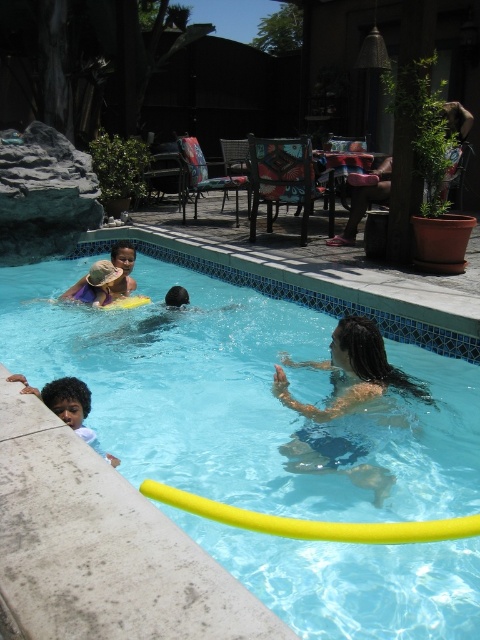
Question: Is brown leather chair at upper right thinner than light brown skin at lower left?

Choices:
 (A) no
 (B) yes

Answer: (A)

Question: Considering the relative positions of transparent blue water at center and light brown skin at lower left in the image provided, where is transparent blue water at center located with respect to light brown skin at lower left?

Choices:
 (A) below
 (B) above

Answer: (B)

Question: Which point is farther to the camera?

Choices:
 (A) (336, 241)
 (B) (33, 394)
 (C) (334, 340)
 (D) (248, 465)

Answer: (A)

Question: Which point is farther to the camera?

Choices:
 (A) light brown skin at lower left
 (B) dark brown hair at center
 (C) brown leather chair at upper right

Answer: (C)

Question: Is transparent blue water at center below light brown skin at lower left?

Choices:
 (A) no
 (B) yes

Answer: (A)

Question: Which point is farther to the camera?

Choices:
 (A) brown leather chair at upper right
 (B) transparent blue water at center
 (C) dark brown hair at center

Answer: (A)